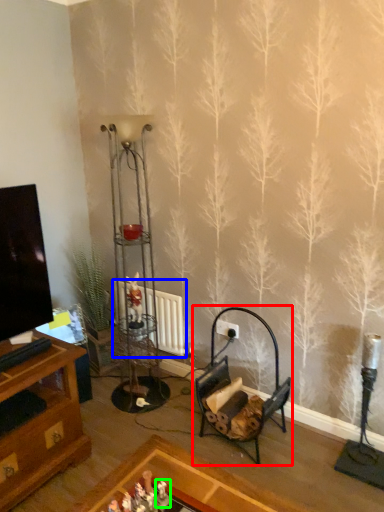
Question: Which is farther away from rocking chair (highlighted by a red box)? radiator (highlighted by a blue box) or toy (highlighted by a green box)?

Choices:
 (A) radiator
 (B) toy

Answer: (B)